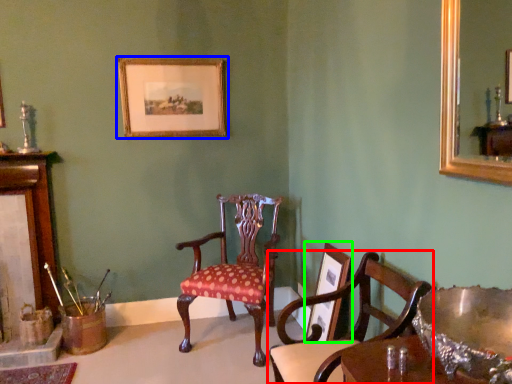
Question: Considering the real-world distances, which object is closest to chair (highlighted by a red box)? picture frame (highlighted by a blue box) or picture frame (highlighted by a green box).

Choices:
 (A) picture frame
 (B) picture frame

Answer: (B)